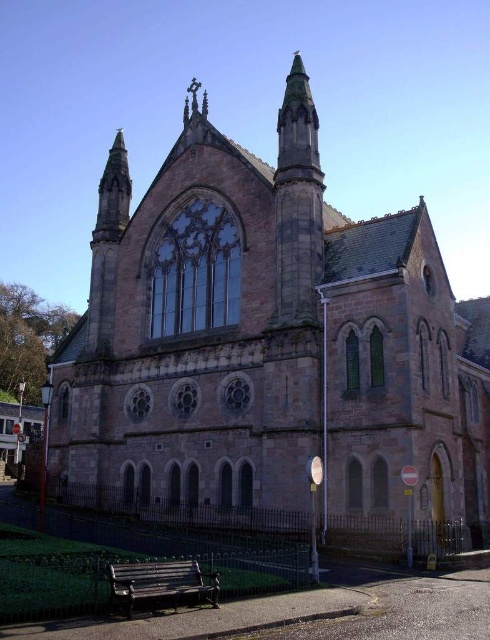
Question: Can you confirm if green stone spire at upper center is thinner than metallic green bench at lower center?

Choices:
 (A) yes
 (B) no

Answer: (B)

Question: Among these points, which one is farthest from the camera?

Choices:
 (A) click(303, 170)
 (B) click(192, 573)

Answer: (A)

Question: Does green stone spire at upper center come behind metallic green bench at lower center?

Choices:
 (A) no
 (B) yes

Answer: (B)

Question: Which point is farther from the camera taking this photo?

Choices:
 (A) (170, 588)
 (B) (291, 138)

Answer: (B)

Question: Which point is farther to the camera?

Choices:
 (A) green stone spire at upper center
 (B) metallic green bench at lower center

Answer: (A)

Question: Does green stone spire at upper center appear on the right side of metallic green bench at lower center?

Choices:
 (A) yes
 (B) no

Answer: (A)